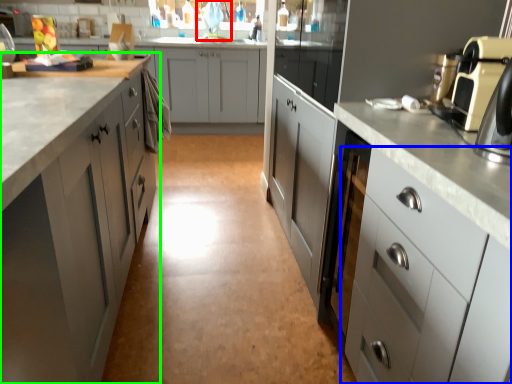
Question: Which is farther away from faucet (highlighted by a red box)? cabinetry (highlighted by a blue box) or cabinetry (highlighted by a green box)?

Choices:
 (A) cabinetry
 (B) cabinetry

Answer: (A)